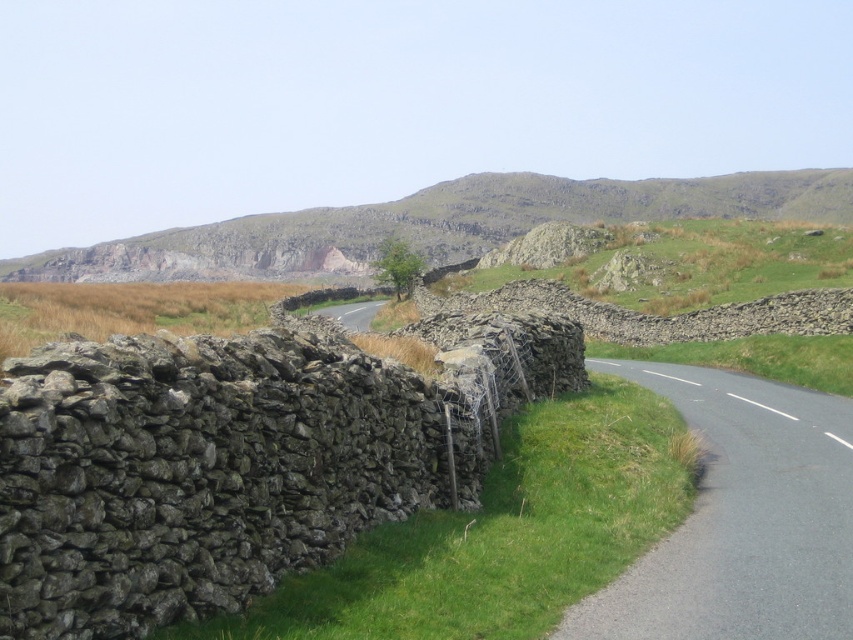
Question: Does gray asphalt road at center-right come behind rugged stone hillside at upper center?

Choices:
 (A) yes
 (B) no

Answer: (B)

Question: Does gray asphalt road at center-right have a greater width compared to rugged stone hillside at upper center?

Choices:
 (A) yes
 (B) no

Answer: (B)

Question: Does gray asphalt road at center-right have a greater width compared to rugged stone hillside at upper center?

Choices:
 (A) no
 (B) yes

Answer: (A)

Question: Which object appears closest to the camera in this image?

Choices:
 (A) gray asphalt road at center-right
 (B) rugged stone hillside at upper center

Answer: (A)

Question: Which point is closer to the camera?

Choices:
 (A) rugged stone hillside at upper center
 (B) gray asphalt road at center-right

Answer: (B)